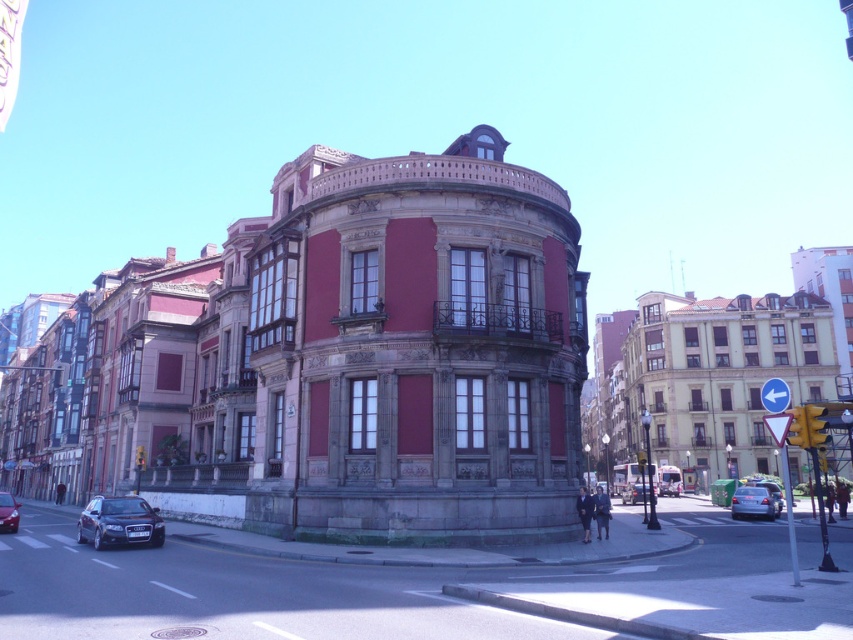
You are standing at the camera position observing the urban street scene. There is a specific point at coordinates point (120, 520). If you want to place a 30 meter long banner from the camera position to that point, will the banner be long enough to reach the point?

The distance of point (120, 520) from camera is 34.29 meters, so the 30 meter long banner is not long enough to reach the point.

You are a delivery person trying to park your 1.8 meters tall delivery cart between the satin black car at lower left and the shiny black sedan at lower left. Can your cart fit vertically between them?

The satin black car at lower left is much taller than the shiny black sedan at lower left. Since the delivery cart is 1.8 meters tall, it should fit vertically between them as long as the space between the two vehicles is at least 1.8 meters in height.

You are standing at the center of the street in this urban scene. You want to walk to the satin black car at lower left. Based on the coordinates provided, in which general direction should you head?

The satin black car at lower left is located at coordinates point (119,522). Since you are at the center of the street, you should head towards the lower left direction to reach the satin black car at lower left.